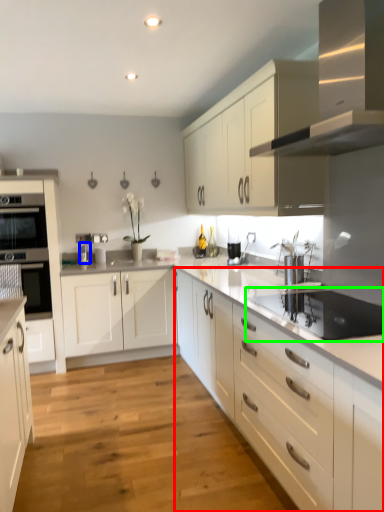
Question: Estimate the real-world distances between objects in this image. Which object is closer to cabinetry (highlighted by a red box), faucet (highlighted by a blue box) or appliance (highlighted by a green box)?

Choices:
 (A) faucet
 (B) appliance

Answer: (B)